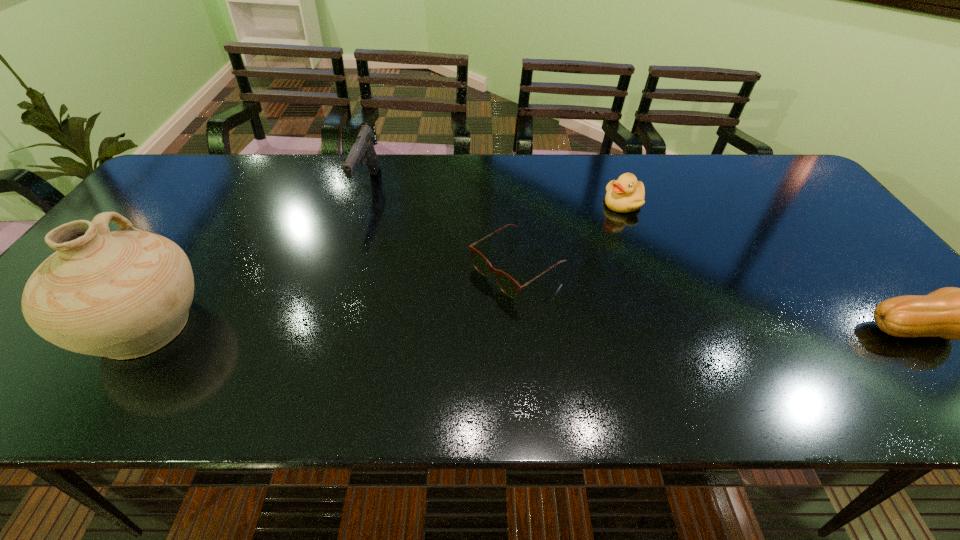
This screenshot has height=540, width=960. What are the coordinates of `unoccupied position between the gun and the fourth object from left to right` in the screenshot? It's located at point(496,195).

In order to click on free space between the fourth object from left to right and the gun in this screenshot , I will do `click(496, 195)`.

Select which object appears as the third closest to the spectacles. Please provide its 2D coordinates. Your answer should be formatted as a tuple, i.e. [(x, y)], where the tuple contains the x and y coordinates of a point satisfying the conditions above.

[(124, 294)]

Identify which object is the fourth closest to the fourth object from right to left. Please provide its 2D coordinates. Your answer should be formatted as a tuple, i.e. [(x, y)], where the tuple contains the x and y coordinates of a point satisfying the conditions above.

[(952, 313)]